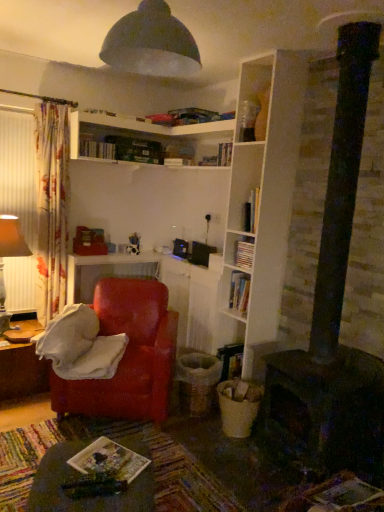
Question: Does matte brown table lamp at left have a greater width compared to wooden table at lower left, the first table viewed from the back?

Choices:
 (A) yes
 (B) no

Answer: (B)

Question: Does matte brown table lamp at left lie in front of wooden table at lower left, which is counted as the 1th table, starting from the left?

Choices:
 (A) no
 (B) yes

Answer: (B)

Question: From the image's perspective, is matte brown table lamp at left located beneath wooden table at lower left, which is counted as the 1th table, starting from the left?

Choices:
 (A) no
 (B) yes

Answer: (A)

Question: From the image's perspective, is matte brown table lamp at left over wooden table at lower left, which is counted as the 1th table, starting from the left?

Choices:
 (A) no
 (B) yes

Answer: (B)

Question: From a real-world perspective, is matte brown table lamp at left over wooden table at lower left, the 2th table when ordered from right to left?

Choices:
 (A) yes
 (B) no

Answer: (A)

Question: Is matte brown table lamp at left outside of wooden table at lower left, which is counted as the 1th table, starting from the left?

Choices:
 (A) yes
 (B) no

Answer: (A)

Question: Can you confirm if wooden table at lower left, which is counted as the 1th table, starting from the left, is smaller than wooden tray at lower center, marked as the 2th table in a left-to-right arrangement?

Choices:
 (A) yes
 (B) no

Answer: (B)

Question: Is wooden table at lower left, which is counted as the 1th table, starting from the left, looking in the opposite direction of wooden tray at lower center, marked as the 2th table in a left-to-right arrangement?

Choices:
 (A) no
 (B) yes

Answer: (A)

Question: Is wooden table at lower left, which ranks as the second table in front-to-back order, directly adjacent to wooden tray at lower center, marked as the 2th table in a left-to-right arrangement?

Choices:
 (A) no
 (B) yes

Answer: (A)

Question: From a real-world perspective, is wooden table at lower left, the 2th table when ordered from right to left, over wooden tray at lower center, marked as the 2th table in a left-to-right arrangement?

Choices:
 (A) no
 (B) yes

Answer: (A)

Question: Could wooden tray at lower center, marked as the 2th table in a left-to-right arrangement, be considered to be inside wooden table at lower left, the first table viewed from the back?

Choices:
 (A) yes
 (B) no

Answer: (B)

Question: Is wooden table at lower left, which is counted as the 1th table, starting from the left, wider than wooden tray at lower center, positioned as the first table in right-to-left order?

Choices:
 (A) no
 (B) yes

Answer: (B)

Question: From the image's perspective, is white matte bookshelf at center, the 2th book viewed from the top, on top of white wooden shelves at upper center?

Choices:
 (A) yes
 (B) no

Answer: (B)